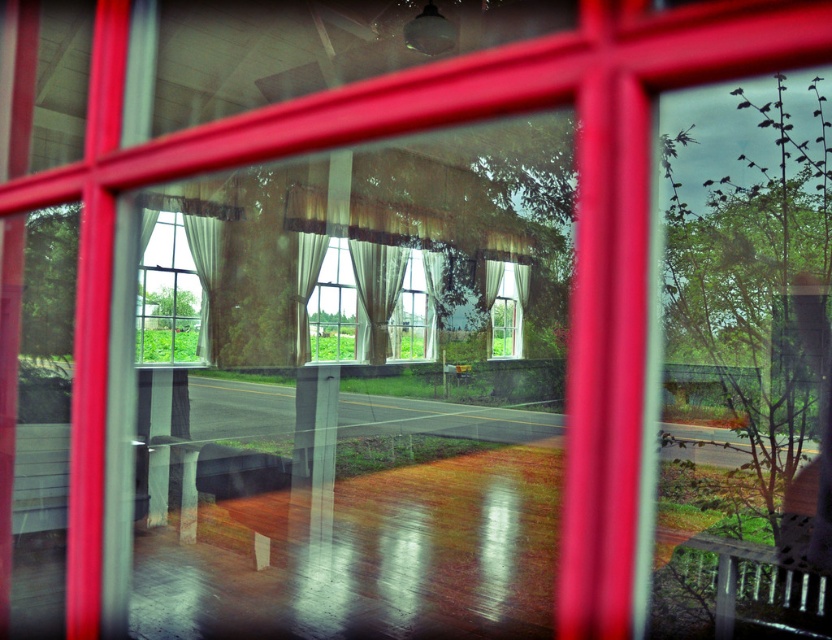
You are standing inside the room and want to sit on the wooden park bench at lower right. Can you walk directly to it without moving past the white sheer curtain at center?

The wooden park bench at lower right is below the white sheer curtain at center, so you can walk directly to it without moving past the curtain since it is positioned lower.

You are standing inside the room with the dark sofa. You want to sit on the wooden park bench at lower right but need to pass through the area near the translucent white curtains at center. Based on their positions, can you walk directly to the bench without moving the curtains?

The wooden park bench at lower right is located below the translucent white curtains at center, so you can walk directly to the bench without needing to move the curtains since it is positioned underneath them.